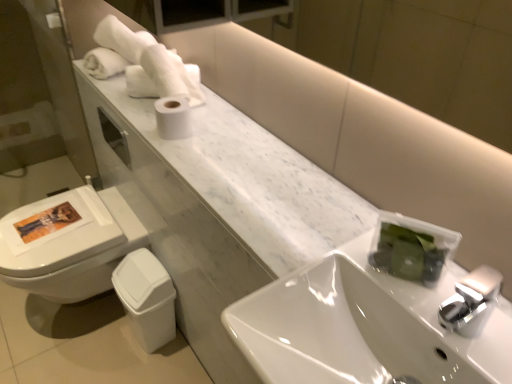
Question: Looking at their shapes, would you say white glossy sink at center is wider or thinner than white marble counter at upper left?

Choices:
 (A) wide
 (B) thin

Answer: (A)

Question: From the image's perspective, is white glossy sink at center located above or below white marble counter at upper left?

Choices:
 (A) below
 (B) above

Answer: (A)

Question: Which object is positioned closest to the white matte toilet paper at center?

Choices:
 (A) white marble counter at upper left
 (B) white soft towel at upper left
 (C) white glossy sink at center

Answer: (B)

Question: Which of these objects is positioned closest to the white matte toilet paper at center?

Choices:
 (A) white soft towel at upper left
 (B) white marble counter at upper left
 (C) white glossy sink at center

Answer: (A)